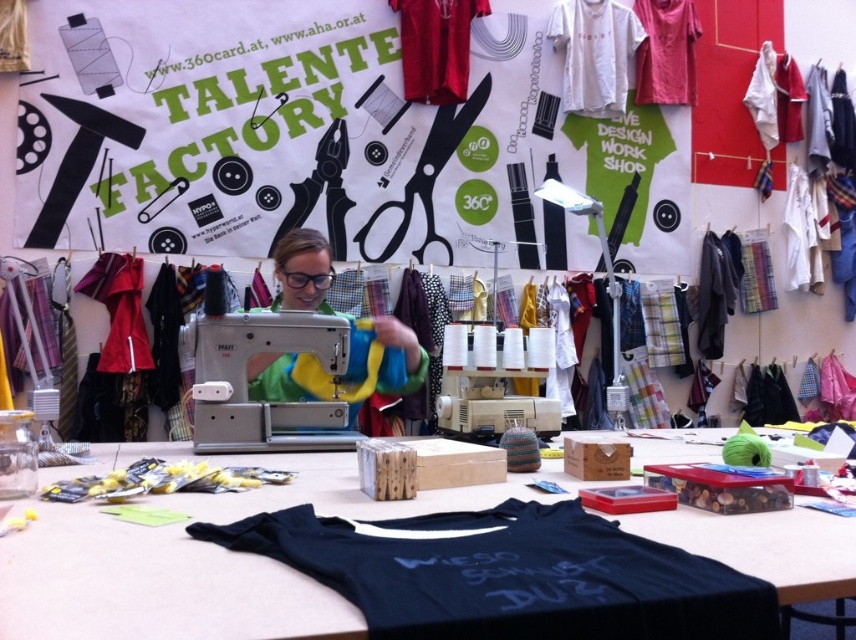
Question: Which point is closer to the camera?

Choices:
 (A) (675, 548)
 (B) (248, 362)
 (C) (702, 332)

Answer: (A)

Question: Is black fabric shirt at center smaller than matte pink t-shirt at upper right?

Choices:
 (A) yes
 (B) no

Answer: (B)

Question: Is metallic sewing machine at center below white cotton t-shirt at upper center?

Choices:
 (A) yes
 (B) no

Answer: (A)

Question: Can you confirm if metallic sewing machine at center is wider than black fabric jacket at right?

Choices:
 (A) no
 (B) yes

Answer: (B)

Question: Among these points, which one is nearest to the camera?

Choices:
 (A) (635, 1)
 (B) (419, 74)

Answer: (B)

Question: Estimate the real-world distances between objects in this image. Which object is closer to the matte red t-shirt at upper center?

Choices:
 (A) dark blue jersey at center
 (B) black fabric jacket at right

Answer: (B)